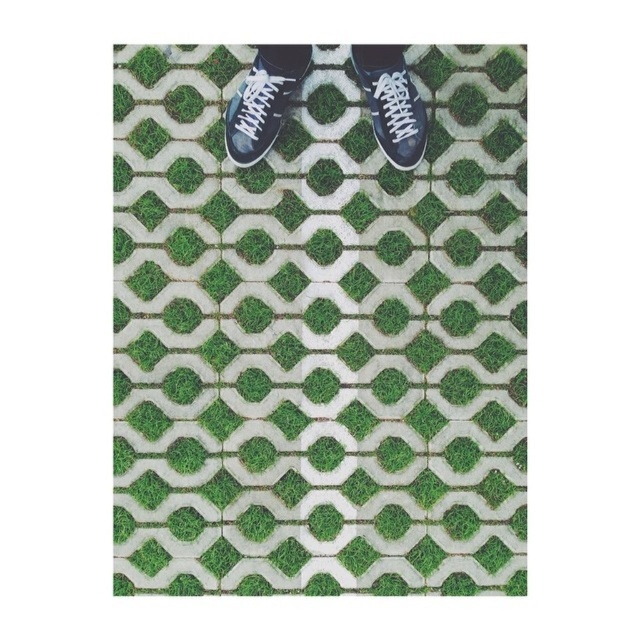
You are a gardener trying to place a new decorative stone between the black leather shoe at center and the matte black sneaker at upper right. Based on their positions, which shoe should you place the stone closer to ensure it fits within the space between them?

The stone should be placed closer to the matte black sneaker at upper right because the black leather shoe at center is wider than the matte black sneaker at upper right, leaving more space near the sneaker.

You are standing on the pavement and notice the green grass at center and the black leather shoe at center. Which object is directly above the other?

The black leather shoe at center is directly above the green grass at center because the green grass at center is located below it.